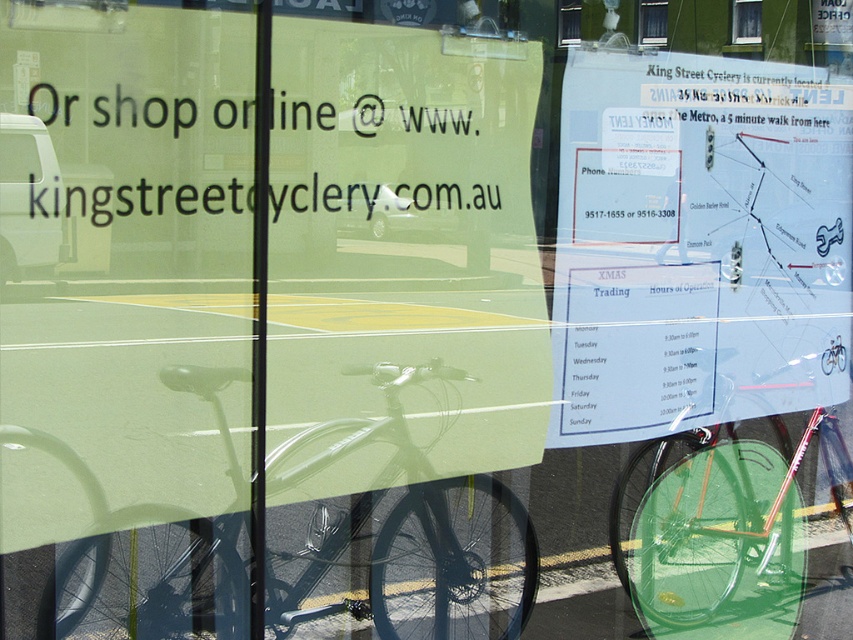
You are a customer looking at the storefront window and notice two bicycles reflected in the glass. Which bicycle is closer to you, the shiny metallic bicycle at center or the green matte bicycle at center?

The shiny metallic bicycle at center is closer to you because it is positioned over the green matte bicycle at center in the reflection.

In the scene shown: You are a tourist holding a map and a bicycle. You look through the storefront window and see the white paper map at upper center and the shiny metallic bicycle at center. Which object is closer to you based on their positions in the window reflection?

The white paper map at upper center is closer to you because it is positioned over the shiny metallic bicycle at center in the reflection.